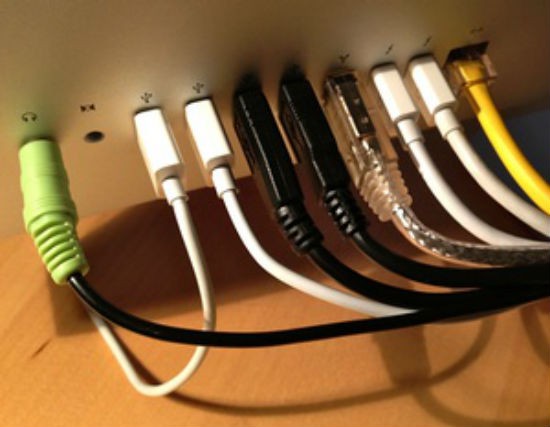
Find the location of a particular element. The height and width of the screenshot is (427, 550). cables to the right of center is located at coordinates (300, 134), (363, 117), (397, 98), (432, 93), (475, 72).